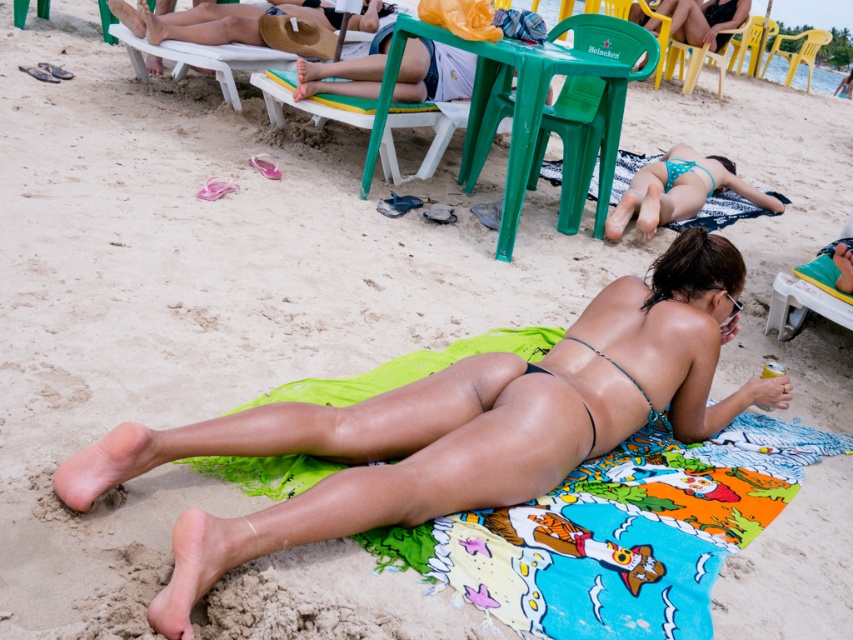
Question: Can you confirm if matte green towel at center is wider than blue shiny bikini at center?

Choices:
 (A) yes
 (B) no

Answer: (A)

Question: Based on their relative distances, which object is farther from the green plastic chair at center?

Choices:
 (A) matte green towel at center
 (B) blue shiny bikini at center
 (C) teal bikini top at upper right

Answer: (A)

Question: Is yellow plastic chair at upper right positioned at the back of green string bikini top at center?

Choices:
 (A) yes
 (B) no

Answer: (A)

Question: Does yellow plastic chair at upper right have a greater width compared to green string bikini top at center?

Choices:
 (A) no
 (B) yes

Answer: (B)

Question: Estimate the real-world distances between objects in this image. Which object is farther from the yellow plastic beach chair at upper right?

Choices:
 (A) green plastic chair at center
 (B) green string bikini top at center
 (C) blue shiny bikini at center

Answer: (B)

Question: Among these points, which one is nearest to the camera?

Choices:
 (A) (770, 52)
 (B) (637, 211)
 (C) (483, 394)

Answer: (C)